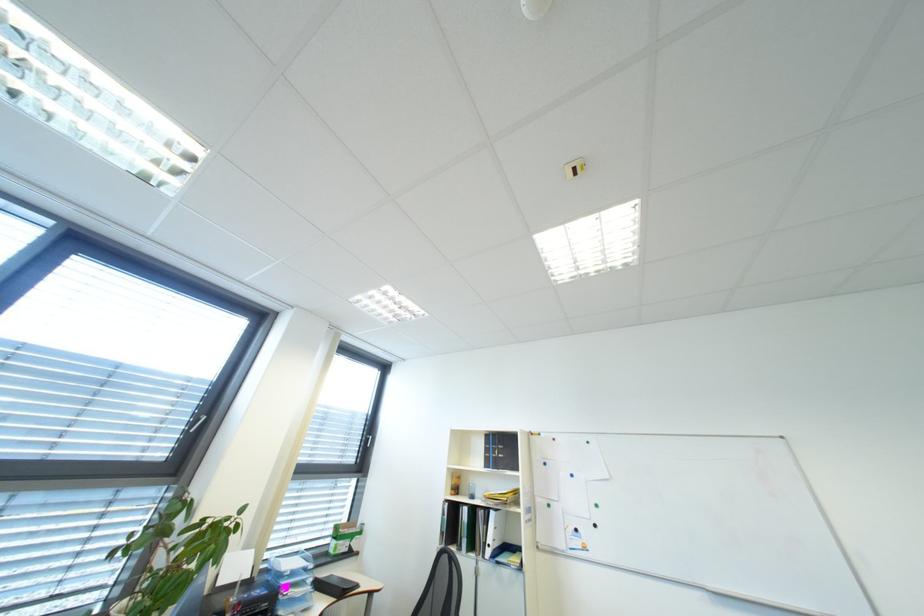
At what (x,y) coordinates should I click in order to perform the action: click on blue book. Please return your answer as a coordinate pair (x, y). Image resolution: width=924 pixels, height=616 pixels. Looking at the image, I should click on (292, 582).